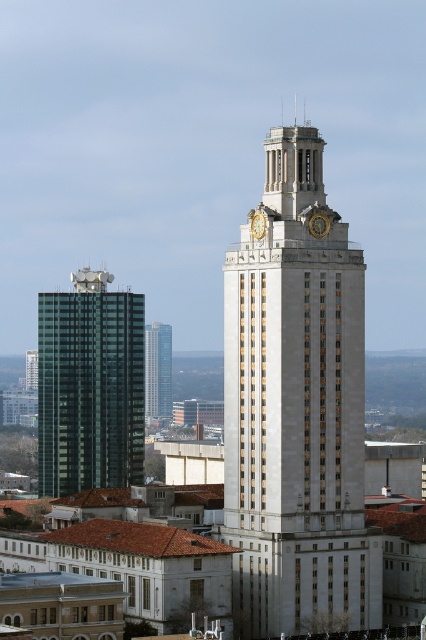
Question: Which point is closer to the camera?

Choices:
 (A) green glass building at left
 (B) glassy teal skyscraper at center-left
 (C) gold metallic clock at center

Answer: (C)

Question: Which of these objects is positioned farthest from the gold metallic clock at center?

Choices:
 (A) goldmaterial/textureclock at upper center
 (B) green glass building at left

Answer: (B)

Question: Can you confirm if white stone clock tower at upper center is wider than gold metallic clock at center?

Choices:
 (A) yes
 (B) no

Answer: (A)

Question: Which is farther from the white stone clock tower at center?

Choices:
 (A) goldmaterial/textureclock at upper center
 (B) white stone clock tower at upper center
 (C) glassy teal skyscraper at center-left
 (D) gold metallic clock at center

Answer: (C)

Question: Does green glass building at left have a larger size compared to white stone clock tower at upper center?

Choices:
 (A) yes
 (B) no

Answer: (A)

Question: Can you confirm if glassy teal skyscraper at center-left is bigger than goldmaterial/textureclock at upper center?

Choices:
 (A) no
 (B) yes

Answer: (B)